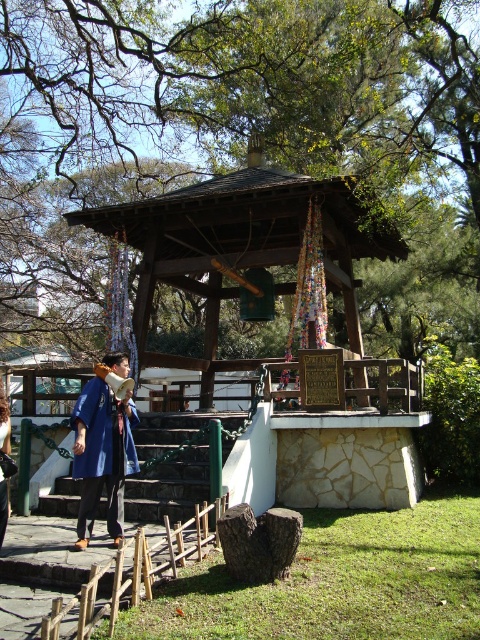
You are standing at the base of the green stone stairs at center. You want to walk towards the pavilion. In which direction should you move relative to your current position?

Since the green stone stairs at center are already positioned at the base leading up to the pavilion, you should move forward towards the pavilion along the stairs.

You are carrying a blue fabric coat at center and need to walk up the green stone stairs at center. Will the stairs be wide enough for you to climb them while holding the coat?

The green stone stairs at center has a width larger than the blue fabric coat at center, so yes, the stairs are wide enough for you to climb while holding the coat.